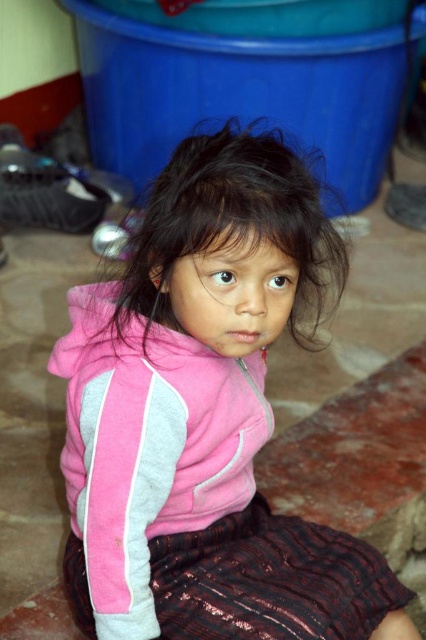
Question: In this image, where is pink fabric at center located relative to dark brown silky hair at center?

Choices:
 (A) above
 (B) below

Answer: (B)

Question: Which point is closer to the camera?

Choices:
 (A) pink fabric at center
 (B) dark brown silky hair at center

Answer: (A)

Question: Which object is farther from the camera taking this photo?

Choices:
 (A) pink fabric at center
 (B) dark brown silky hair at center

Answer: (B)

Question: Is pink fabric at center in front of dark brown silky hair at center?

Choices:
 (A) no
 (B) yes

Answer: (B)

Question: Where is pink fabric at center located in relation to dark brown silky hair at center in the image?

Choices:
 (A) right
 (B) left

Answer: (B)